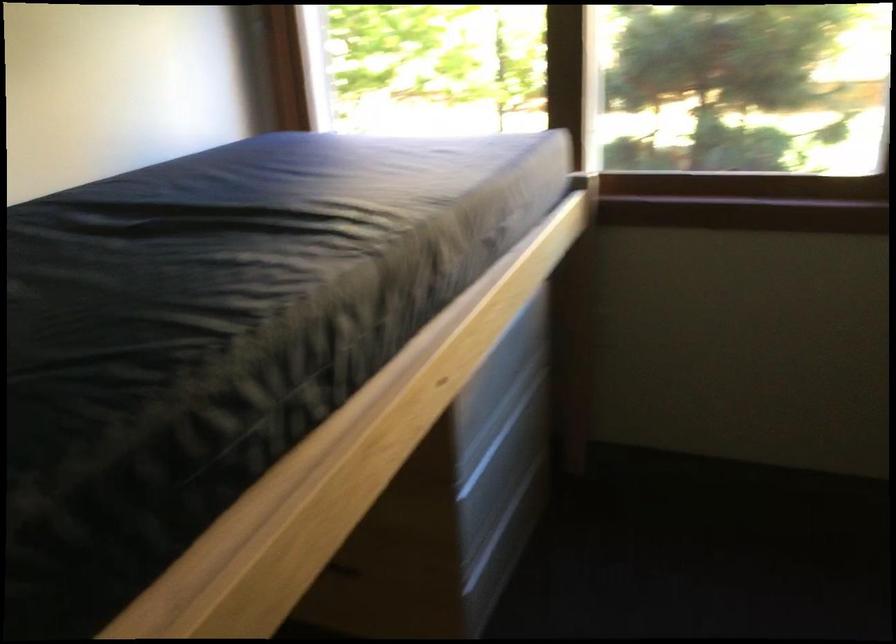
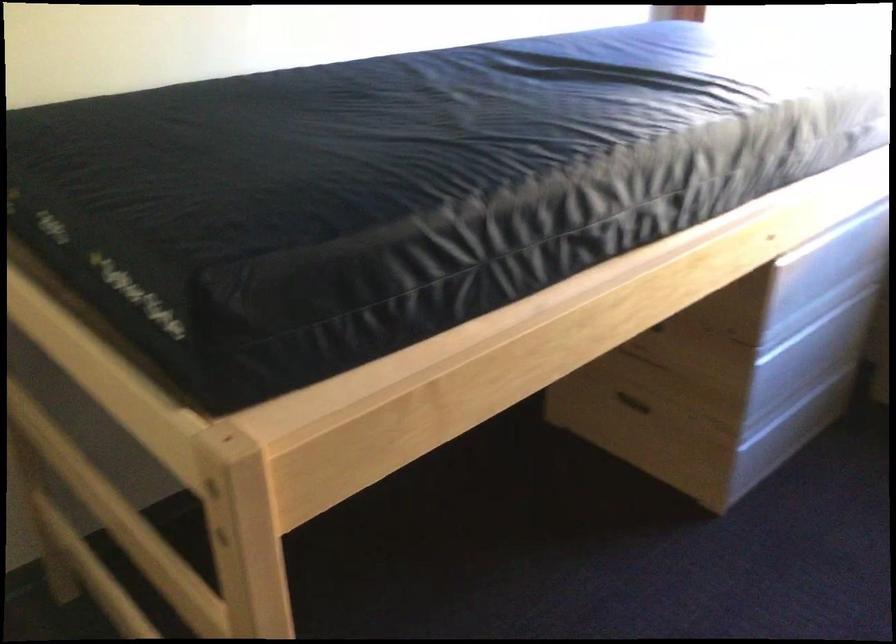
Where in the second image is the point corresponding to (345,571) from the first image?

(633, 402)